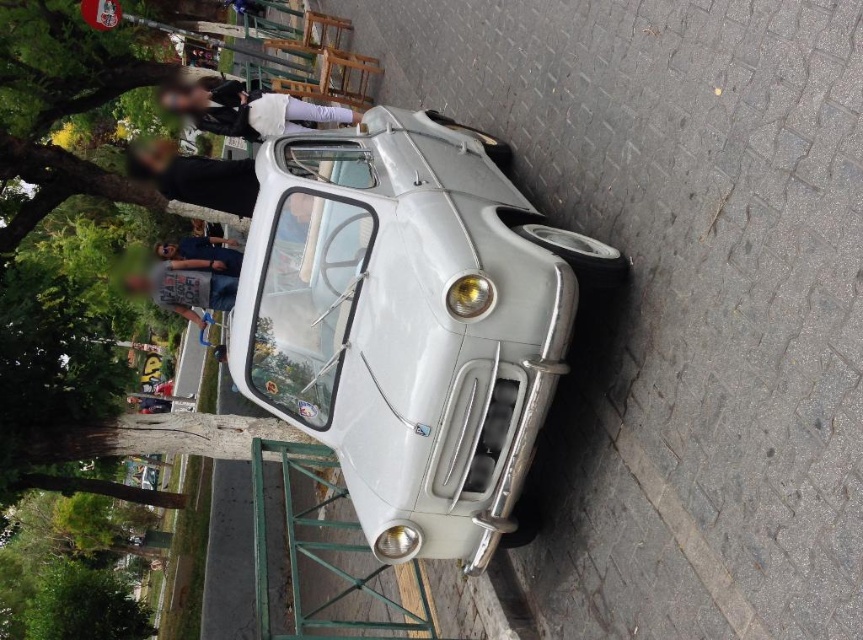
Can you confirm if white fabric shirt at upper center is wider than brushed metal shirt at center?

Yes.

Which is in front, point (320, 118) or point (131, 289)?

Positioned in front is point (320, 118).

Where is `white fabric shirt at upper center`? This screenshot has width=863, height=640. white fabric shirt at upper center is located at coordinates [247, 108].

Can you confirm if brushed metal shirt at center is positioned below matte black t-shirt at center?

Yes, brushed metal shirt at center is below matte black t-shirt at center.

Locate an element on the screen. The width and height of the screenshot is (863, 640). brushed metal shirt at center is located at coordinates (184, 285).

In the scene shown: Does white metallic car at center appear on the right side of white fabric shirt at upper center?

Correct, you'll find white metallic car at center to the right of white fabric shirt at upper center.

Describe the element at coordinates (408, 321) in the screenshot. I see `white metallic car at center` at that location.

Find the location of `white metallic car at center`. white metallic car at center is located at coordinates (408, 321).

Identify the location of white metallic car at center. (408, 321).